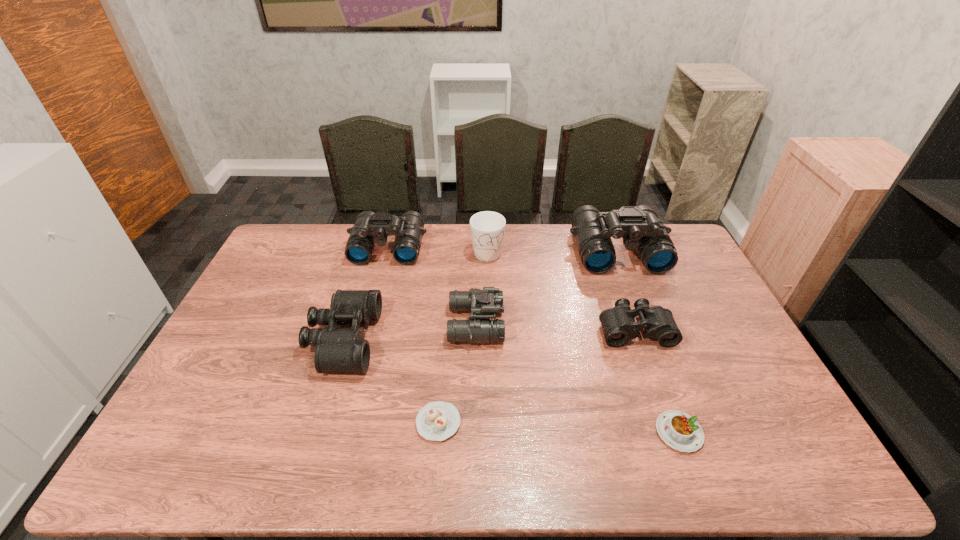
Where is `vacant space that satisfies the following two spatial constraints: 1. on the side of the mug with the handle; 2. at the eyepieces of the left black binoculars`? This screenshot has width=960, height=540. vacant space that satisfies the following two spatial constraints: 1. on the side of the mug with the handle; 2. at the eyepieces of the left black binoculars is located at coordinates [x=489, y=339].

Where is `vacant space that satisfies the following two spatial constraints: 1. through the lenses of the biggest blue binoculars; 2. at the eyepieces of the bigger black binoculars`? vacant space that satisfies the following two spatial constraints: 1. through the lenses of the biggest blue binoculars; 2. at the eyepieces of the bigger black binoculars is located at coordinates (652, 339).